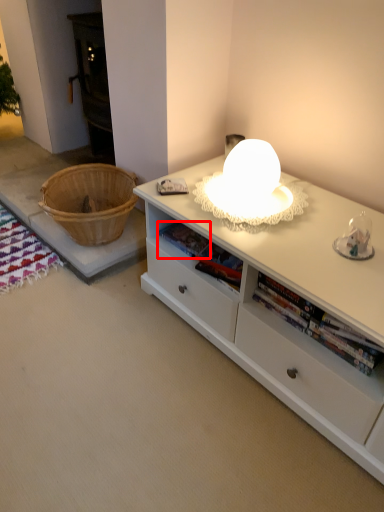
Question: In this image, where is book (annotated by the red box) located relative to desk?

Choices:
 (A) left
 (B) right

Answer: (B)